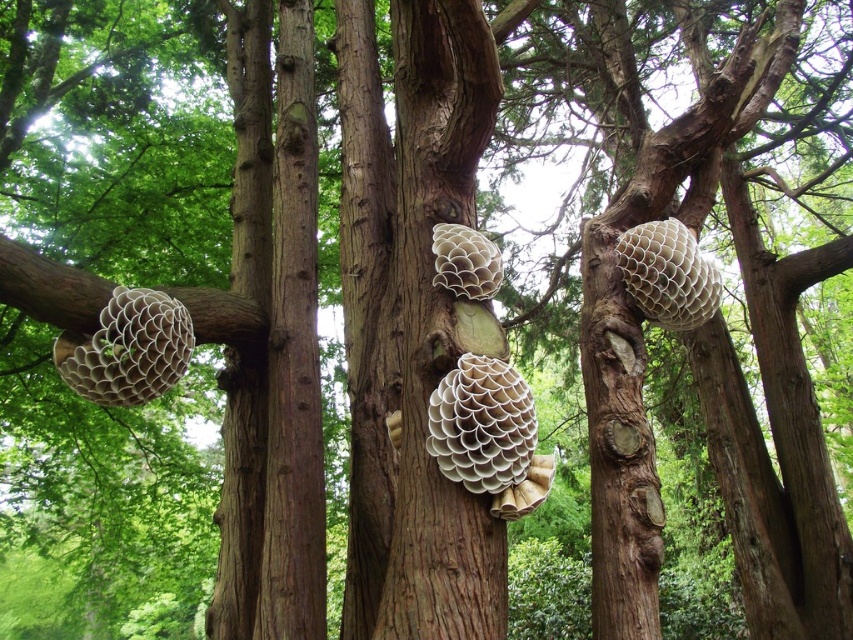
What is the color and material of the object located at point (x=128, y=349) in the image?

The object at point (x=128, y=349) is a white matte beehive.

You are a beekeeper examining the trees and their beehives. You notice the white matte beehive at left and the white honeycomb beehive at upper right. Which beehive has a greater width?

The white matte beehive at left might be wider than the white honeycomb beehive at upper right according to the description.